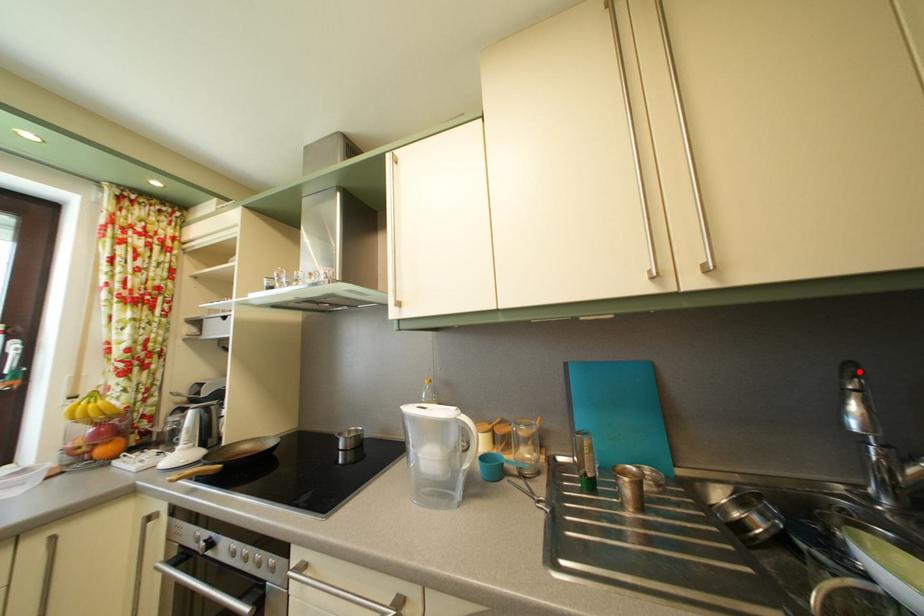
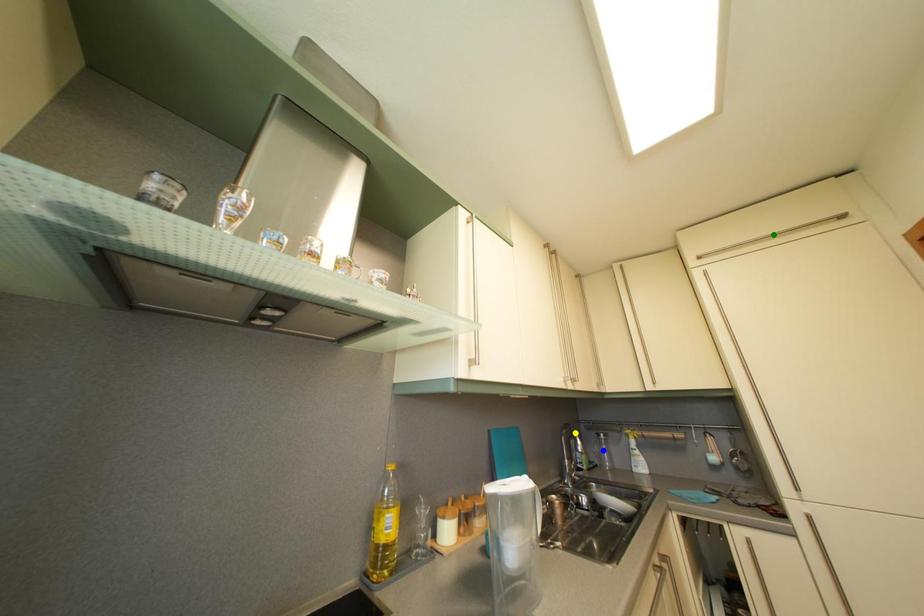
Question: I am providing you with two images of the same scene from different viewpoints. A red point is marked on the first image. You are given multiple points on the second image. Can you choose the point in image 2 that corresponds to the point in image 1?

Choices:
 (A) yellow point
 (B) blue point
 (C) green point

Answer: (A)